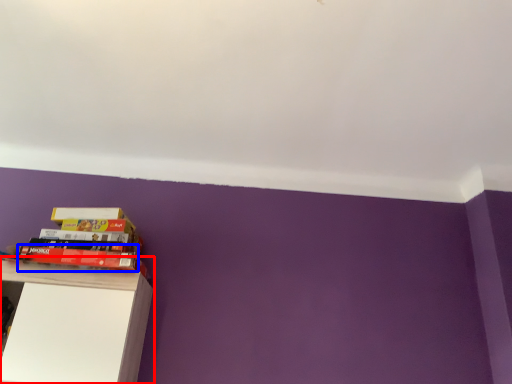
Question: Which object is closer to the camera taking this photo, shelf (highlighted by a red box) or paperback book (highlighted by a blue box)?

Choices:
 (A) shelf
 (B) paperback book

Answer: (A)